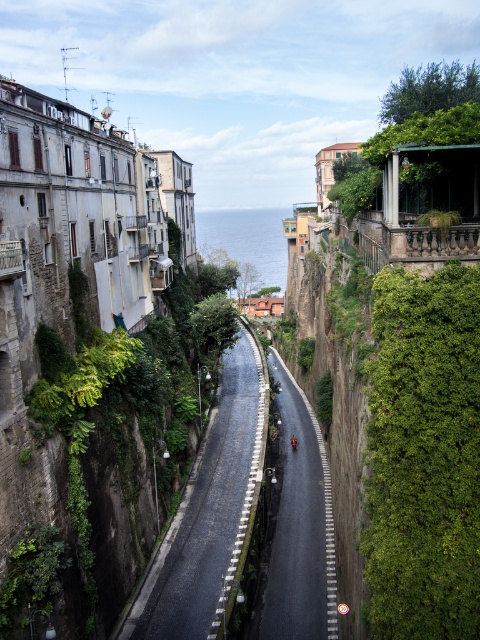
Between green leafy wall at right and metallic red motorcycle at center, which one is positioned lower?

metallic red motorcycle at center

Image resolution: width=480 pixels, height=640 pixels. Find the location of `green leafy wall at right`. green leafy wall at right is located at coordinates (423, 456).

Image resolution: width=480 pixels, height=640 pixels. In order to click on green leafy wall at right in this screenshot , I will do `click(423, 456)`.

Is green leafy wall at right shorter than black asphalt road at center?

Incorrect, green leafy wall at right's height does not fall short of black asphalt road at center's.

Which is below, green leafy wall at right or black asphalt road at center?

black asphalt road at center is below.

Between point (395, 372) and point (199, 550), which one is positioned in front?

Point (395, 372) is more forward.

Where is `green leafy wall at right`? This screenshot has width=480, height=640. green leafy wall at right is located at coordinates (423, 456).

Which is more to the right, green leafy vegetation at center or metallic red motorcycle at center?

Positioned to the right is metallic red motorcycle at center.

You are a GUI agent. You are given a task and a screenshot of the screen. Output one action in this format:
    pyautogui.click(x=<x>, y=<y>)
    Task: Click on the green leafy vegetation at center
    This screenshot has height=640, width=480.
    Given the screenshot: What is the action you would take?
    pyautogui.click(x=115, y=449)

The image size is (480, 640). Identify the location of green leafy vegetation at center. (115, 449).

Identify the location of green leafy vegetation at center. This screenshot has height=640, width=480. (115, 449).